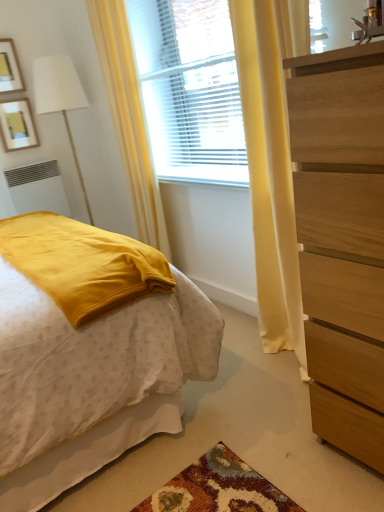
What do you see at coordinates (9, 68) in the screenshot? I see `wooden picture frame at upper left, the 2th picture frame in the bottom-to-top sequence` at bounding box center [9, 68].

Image resolution: width=384 pixels, height=512 pixels. What do you see at coordinates (17, 125) in the screenshot?
I see `wooden picture frame at upper left, placed as the first picture frame when sorted from bottom to top` at bounding box center [17, 125].

The height and width of the screenshot is (512, 384). What are the coordinates of `wooden dresser at right` in the screenshot? It's located at (342, 240).

In order to click on matte yellow blanket at left in this screenshot , I will do `click(89, 351)`.

In the scene shown: Considering the positions of objects wooden picture frame at upper left, which is counted as the 1th picture frame, starting from the top, and wooden dresser at right in the image provided, who is in front, wooden picture frame at upper left, which is counted as the 1th picture frame, starting from the top, or wooden dresser at right?

wooden dresser at right is in front.

Is wooden picture frame at upper left, which is counted as the 1th picture frame, starting from the top, oriented away from wooden dresser at right?

That's not correct — wooden picture frame at upper left, which is counted as the 1th picture frame, starting from the top, is not looking away from wooden dresser at right.

Is wooden picture frame at upper left, which is counted as the 1th picture frame, starting from the top, wider or thinner than wooden dresser at right?

Considering their sizes, wooden picture frame at upper left, which is counted as the 1th picture frame, starting from the top, looks slimmer than wooden dresser at right.

Consider the image. Choose the correct answer: Is wooden picture frame at upper left, the 2th picture frame in the bottom-to-top sequence, inside wooden dresser at right or outside it?

wooden picture frame at upper left, the 2th picture frame in the bottom-to-top sequence, is located beyond the bounds of wooden dresser at right.

Considering the relative sizes of wooden picture frame at upper left, marked as the second picture frame in a top-to-bottom arrangement, and translucent wood window at center in the image provided, is wooden picture frame at upper left, marked as the second picture frame in a top-to-bottom arrangement, taller than translucent wood window at center?

In fact, wooden picture frame at upper left, marked as the second picture frame in a top-to-bottom arrangement, may be shorter than translucent wood window at center.

Considering the relative sizes of wooden picture frame at upper left, placed as the first picture frame when sorted from bottom to top, and translucent wood window at center in the image provided, is wooden picture frame at upper left, placed as the first picture frame when sorted from bottom to top, wider than translucent wood window at center?

No, wooden picture frame at upper left, placed as the first picture frame when sorted from bottom to top, is not wider than translucent wood window at center.

Is wooden picture frame at upper left, placed as the first picture frame when sorted from bottom to top, oriented away from translucent wood window at center?

No, wooden picture frame at upper left, placed as the first picture frame when sorted from bottom to top,'s orientation is not away from translucent wood window at center.

Can you confirm if matte yellow blanket at left is positioned to the right of wooden picture frame at upper left, which is counted as the 1th picture frame, starting from the top?

Correct, you'll find matte yellow blanket at left to the right of wooden picture frame at upper left, which is counted as the 1th picture frame, starting from the top.

Is matte yellow blanket at left facing away from wooden picture frame at upper left, the 2th picture frame in the bottom-to-top sequence?

matte yellow blanket at left does not have its back to wooden picture frame at upper left, the 2th picture frame in the bottom-to-top sequence.

From a real-world perspective, which object rests below the other?

matte yellow blanket at left is physically lower.

Considering the points (134, 321) and (10, 50), which point is in front, point (134, 321) or point (10, 50)?

The point (134, 321) is in front.

Is yellow fabric curtain at left in contact with translucent wood window at center?

They are not placed beside each other.

Would you say yellow fabric curtain at left is to the left or to the right of translucent wood window at center in the picture?

In the image, yellow fabric curtain at left appears on the left side of translucent wood window at center.

Which object is closer to the camera, yellow fabric curtain at left or translucent wood window at center?

Positioned in front is translucent wood window at center.

You are a GUI agent. You are given a task and a screenshot of the screen. Output one action in this format:
    pyautogui.click(x=<x>, y=<y>)
    Task: Click on the window on the right of yellow fabric curtain at left
    The width and height of the screenshot is (384, 512).
    Given the screenshot: What is the action you would take?
    pyautogui.click(x=190, y=89)

Between point (348, 243) and point (63, 215), which one is positioned in front?

The point (348, 243) is more forward.

Looking at the image, does wooden dresser at right seem bigger or smaller compared to white matte radiator at lower left?

wooden dresser at right is bigger than white matte radiator at lower left.

Is wooden dresser at right at the left side of white matte radiator at lower left?

No, wooden dresser at right is not to the left of white matte radiator at lower left.

Does point (7, 51) come farther from viewer compared to point (19, 180)?

No, (7, 51) is closer to viewer.

Is wooden picture frame at upper left, the 2th picture frame in the bottom-to-top sequence, in contact with white matte radiator at lower left?

They are not placed beside each other.

Would you say wooden picture frame at upper left, which is counted as the 1th picture frame, starting from the top, is to the left or to the right of white matte radiator at lower left in the picture?

Based on their positions, wooden picture frame at upper left, which is counted as the 1th picture frame, starting from the top, is located to the left of white matte radiator at lower left.

Could you tell me if white matte radiator at lower left is turned towards matte yellow blanket at left?

Yes, white matte radiator at lower left is oriented towards matte yellow blanket at left.

From a real-world perspective, who is located higher, white matte radiator at lower left or matte yellow blanket at left?

white matte radiator at lower left, from a real-world perspective.

Is white matte radiator at lower left next to matte yellow blanket at left?

No.

Relative to matte yellow blanket at left, is white matte radiator at lower left in front or behind?

Visually, white matte radiator at lower left is located behind matte yellow blanket at left.

Image resolution: width=384 pixels, height=512 pixels. What are the coordinates of `the chest of drawers lying in front of the wooden picture frame at upper left, the 2th picture frame in the bottom-to-top sequence` in the screenshot? It's located at (342, 240).

Where is `window on the right side of wooden picture frame at upper left, marked as the second picture frame in a top-to-bottom arrangement`? This screenshot has height=512, width=384. window on the right side of wooden picture frame at upper left, marked as the second picture frame in a top-to-bottom arrangement is located at coordinates (190, 89).

Based on their spatial positions, is matte yellow blanket at left or yellow fabric curtain at left further from wooden picture frame at upper left, marked as the second picture frame in a top-to-bottom arrangement?

matte yellow blanket at left is further to wooden picture frame at upper left, marked as the second picture frame in a top-to-bottom arrangement.

When comparing their distances from wooden dresser at right, does matte yellow blanket at left or wooden picture frame at upper left, placed as the first picture frame when sorted from bottom to top, seem closer?

matte yellow blanket at left is positioned closer to the anchor wooden dresser at right.

Considering their positions, is wooden picture frame at upper left, the 2th picture frame in the bottom-to-top sequence, positioned closer to translucent wood window at center than yellow fabric curtain at left?

yellow fabric curtain at left lies closer to translucent wood window at center than the other object.

Estimate the real-world distances between objects in this image. Which object is further from white matte radiator at lower left, translucent wood window at center or wooden dresser at right?

wooden dresser at right.

Looking at the image, which one is located closer to yellow fabric curtain at left, translucent wood window at center or wooden dresser at right?

translucent wood window at center lies closer to yellow fabric curtain at left than the other object.

From the image, which object appears to be nearer to yellow fabric curtain at left, wooden picture frame at upper left, the 2th picture frame in the bottom-to-top sequence, or wooden picture frame at upper left, marked as the second picture frame in a top-to-bottom arrangement?

Based on the image, wooden picture frame at upper left, marked as the second picture frame in a top-to-bottom arrangement, appears to be nearer to yellow fabric curtain at left.

When comparing their distances from white matte radiator at lower left, does matte yellow blanket at left or wooden dresser at right seem closer?

matte yellow blanket at left is closer to white matte radiator at lower left.

Based on their spatial positions, is matte yellow blanket at left or wooden dresser at right further from wooden picture frame at upper left, placed as the first picture frame when sorted from bottom to top?

Among the two, wooden dresser at right is located further to wooden picture frame at upper left, placed as the first picture frame when sorted from bottom to top.

I want to click on window between wooden dresser at right and wooden picture frame at upper left, marked as the second picture frame in a top-to-bottom arrangement, in the front-back direction, so click(190, 89).

You are a GUI agent. You are given a task and a screenshot of the screen. Output one action in this format:
    pyautogui.click(x=<x>, y=<y>)
    Task: Click on the window between wooden picture frame at upper left, which is counted as the 1th picture frame, starting from the top, and wooden dresser at right
    The image size is (384, 512).
    Given the screenshot: What is the action you would take?
    pyautogui.click(x=190, y=89)

Where is `window between matte yellow blanket at left and white matte radiator at lower left in the front-back direction`? This screenshot has height=512, width=384. window between matte yellow blanket at left and white matte radiator at lower left in the front-back direction is located at coordinates (190, 89).

Where is `picture frame that lies between wooden picture frame at upper left, the 2th picture frame in the bottom-to-top sequence, and white matte radiator at lower left from top to bottom`? This screenshot has width=384, height=512. picture frame that lies between wooden picture frame at upper left, the 2th picture frame in the bottom-to-top sequence, and white matte radiator at lower left from top to bottom is located at coordinates (17, 125).